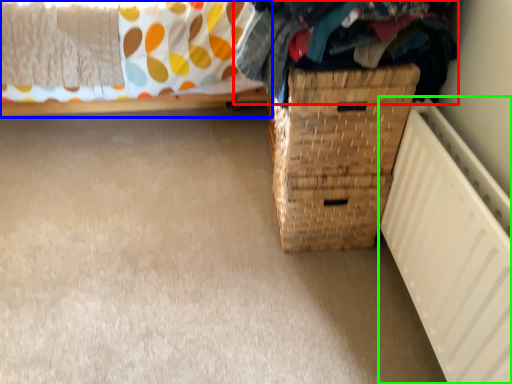
Question: Which object is the farthest from clothing (highlighted by a red box)? Choose among these: furniture (highlighted by a blue box) or radiator (highlighted by a green box).

Choices:
 (A) furniture
 (B) radiator

Answer: (A)